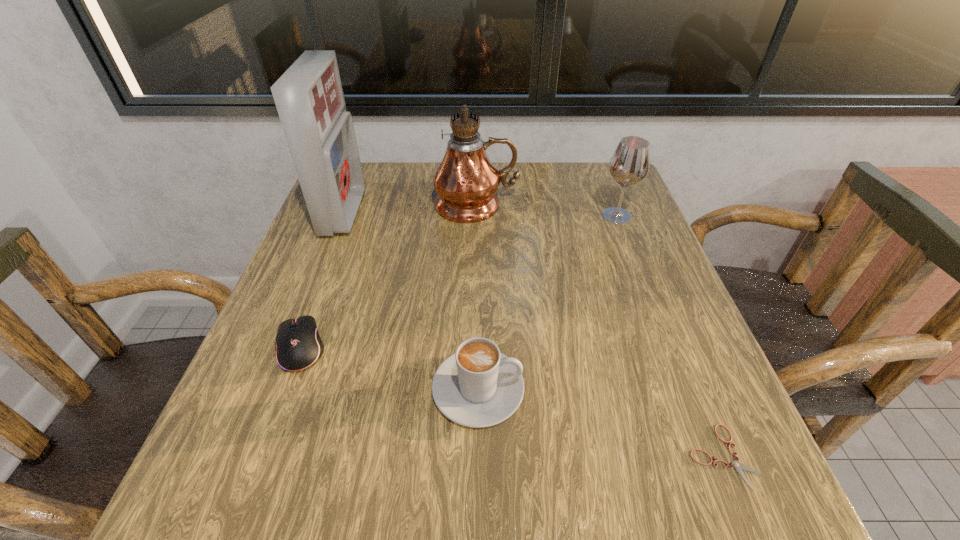
Find the location of a particular element. The image size is (960, 540). free region located 0.100m on the back of the fifth tallest object is located at coordinates (324, 283).

You are a GUI agent. You are given a task and a screenshot of the screen. Output one action in this format:
    pyautogui.click(x=<x>, y=<y>)
    Task: Click on the free spot located 0.350m on the back of the shears
    The height and width of the screenshot is (540, 960).
    Given the screenshot: What is the action you would take?
    pyautogui.click(x=644, y=266)

At what (x,y) coordinates should I click in order to perform the action: click on oil lamp present at the far edge. Please return your answer as a coordinate pair (x, y). The height and width of the screenshot is (540, 960). Looking at the image, I should click on (466, 180).

The width and height of the screenshot is (960, 540). Identify the location of the first-aid kit located at the far edge. 309,98.

Find the location of a particular element. wineglass that is at the far edge is located at coordinates (630, 162).

At what (x,y) coordinates should I click in order to perform the action: click on object that is at the near edge. Please return your answer as a coordinate pair (x, y). This screenshot has height=540, width=960. Looking at the image, I should click on (738, 466).

Locate an element on the screen. the first-aid kit situated at the left edge is located at coordinates (309, 98).

Where is `computer mouse located at the left edge`? This screenshot has width=960, height=540. computer mouse located at the left edge is located at coordinates (298, 345).

Where is `wineglass located in the right edge section of the desktop`? This screenshot has height=540, width=960. wineglass located in the right edge section of the desktop is located at coordinates (630, 162).

Identify the location of shears at the right edge. The width and height of the screenshot is (960, 540). (738, 466).